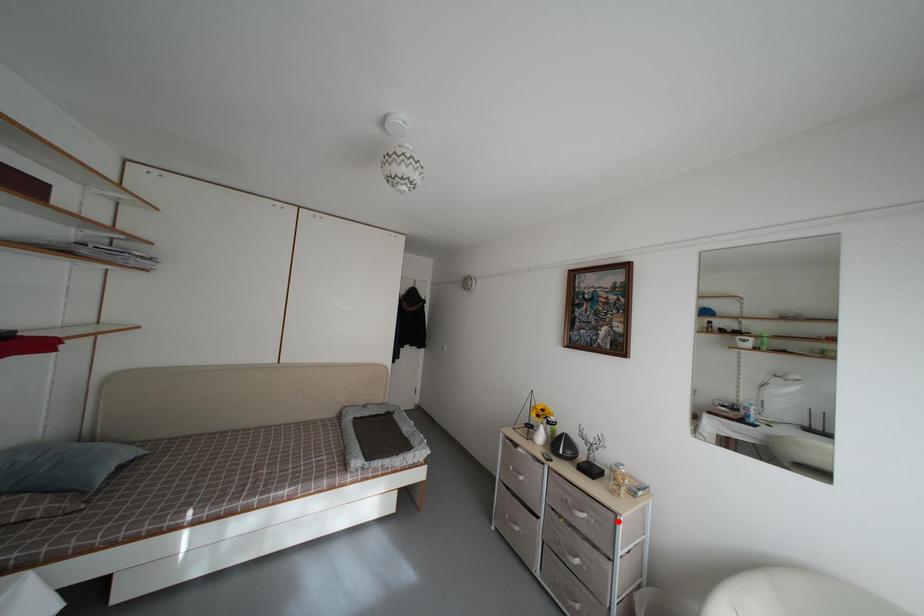
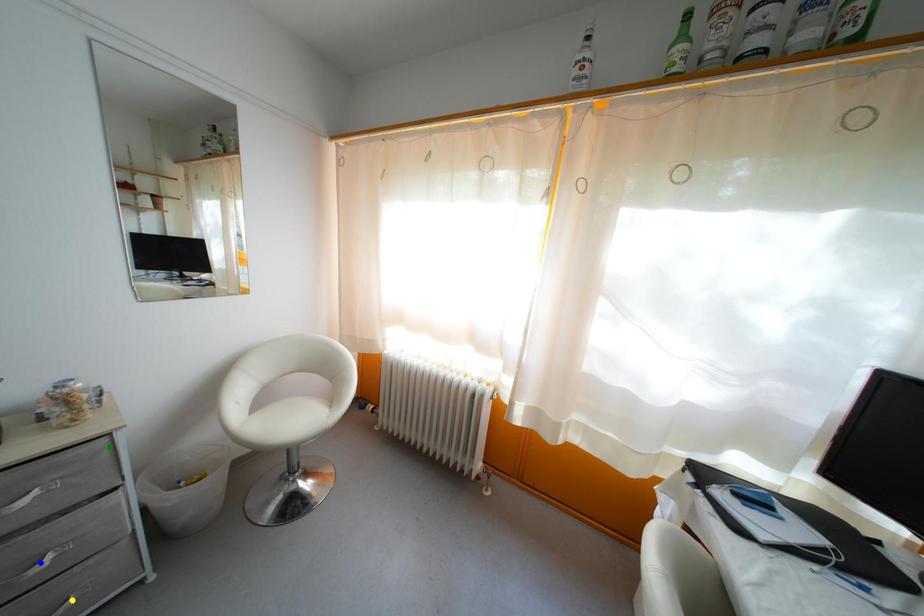
Question: I am providing you with two images of the same scene from different viewpoints. A red point is marked on the first image. You are given multiple points on the second image. Which point in image 2 is actually the same real-world point as the red point in image 1?

Choices:
 (A) blue point
 (B) green point
 (C) yellow point

Answer: (B)